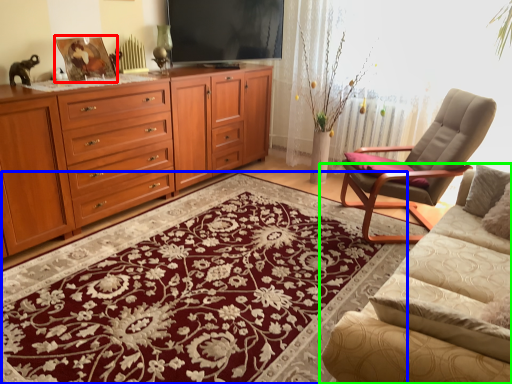
Question: Considering the real-world distances, which object is closest to picture frame (highlighted by a red box)? mat (highlighted by a blue box) or studio couch (highlighted by a green box).

Choices:
 (A) mat
 (B) studio couch

Answer: (A)